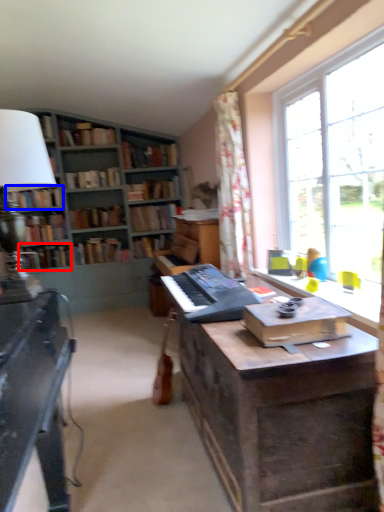
Question: Which object is closer to the camera taking this photo, book (highlighted by a red box) or book (highlighted by a blue box)?

Choices:
 (A) book
 (B) book

Answer: (B)